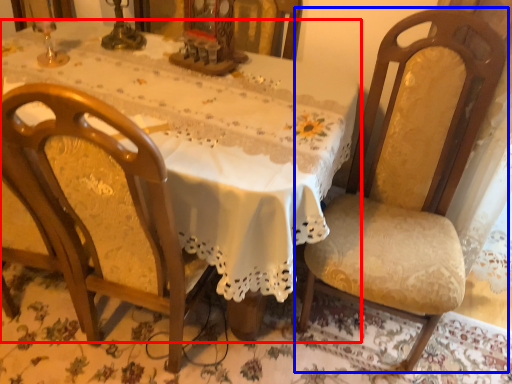
Question: Which object is further to the camera taking this photo, table (highlighted by a red box) or chair (highlighted by a blue box)?

Choices:
 (A) table
 (B) chair

Answer: (A)